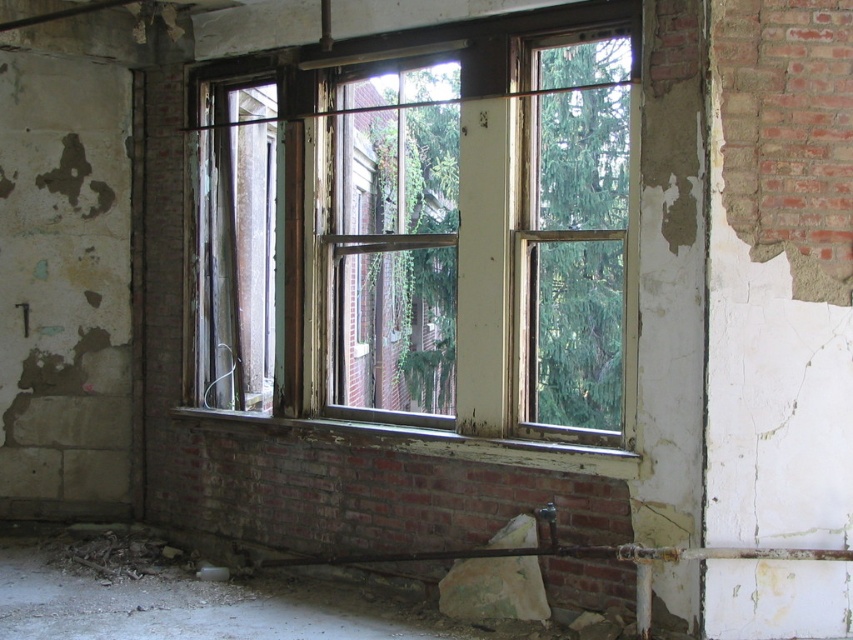
You are a painter who needs to cover the wooden frame window at center and the rusty metal chain at lower left with protective covers. If you have a single cover that fits the larger object, will it also fit the smaller one?

The wooden frame window at center is wider than the rusty metal chain at lower left, so the cover designed for the larger wooden frame window at center will also fit the smaller rusty metal chain at lower left.

You are a contractor assessing the structural integrity of this abandoned building. You notice the wooden frame window at center and the rusty metal chain at lower left. Which object would you prioritize inspecting first based on its size and potential impact on safety?

The wooden frame window at center is larger in size than the rusty metal chain at lower left, so it would have a greater impact on structural safety and should be inspected first.